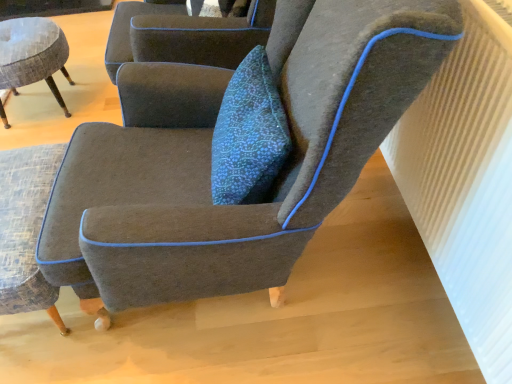
Question: Would you say textured gray armchair at lower left, positioned as the second chair in left-to-right order, is to the left or to the right of textured gray stool at left, the 1th chair viewed from the left, in the picture?

Choices:
 (A) right
 (B) left

Answer: (A)

Question: From the image's perspective, is textured gray armchair at lower left, the second chair when ordered from right to left, located above or below textured gray stool at left, the 1th chair viewed from the left?

Choices:
 (A) above
 (B) below

Answer: (B)

Question: Which object is positioned closest to the textured gray stool at left, the 1th chair viewed from the left?

Choices:
 (A) textured gray armchair at lower left, the second chair when ordered from right to left
 (B) white ribbed radiator at upper right
 (C) dark gray fabric chair at center, the 3th chair when ordered from left to right

Answer: (A)

Question: Estimate the real-world distances between objects in this image. Which object is closer to the white ribbed radiator at upper right?

Choices:
 (A) textured gray armchair at lower left, the second chair when ordered from right to left
 (B) dark gray fabric chair at center, which is the 1th chair in right-to-left order
 (C) textured gray stool at left, the 3th chair when ordered from right to left

Answer: (B)